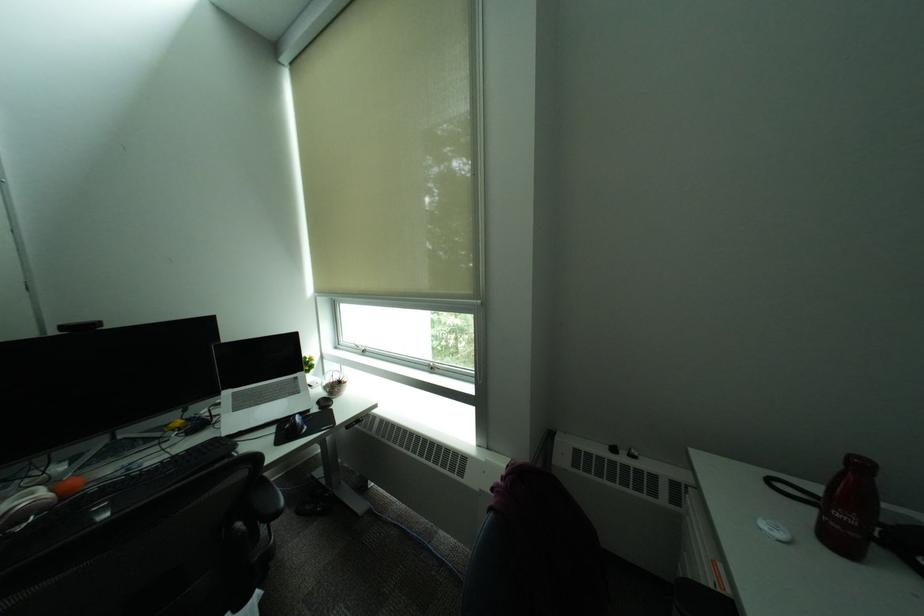
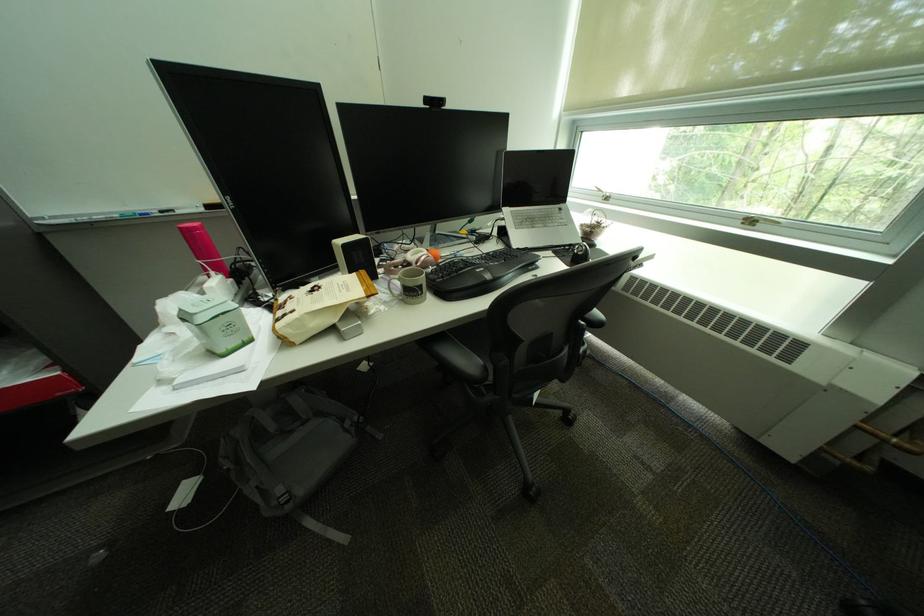
The point at (228, 403) is marked in the first image. Where is the corresponding point in the second image?

(514, 217)